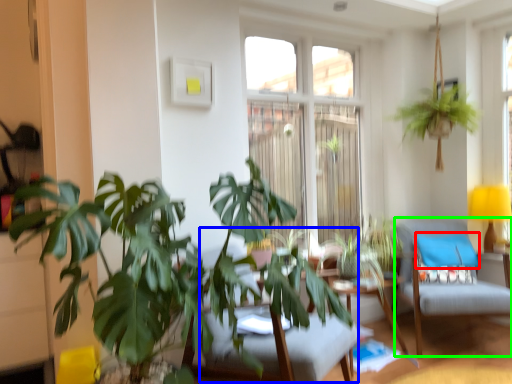
Question: Considering the real-world distances, which object is closest to pillow (highlighted by a red box)? swivel chair (highlighted by a blue box) or swivel chair (highlighted by a green box).

Choices:
 (A) swivel chair
 (B) swivel chair

Answer: (B)